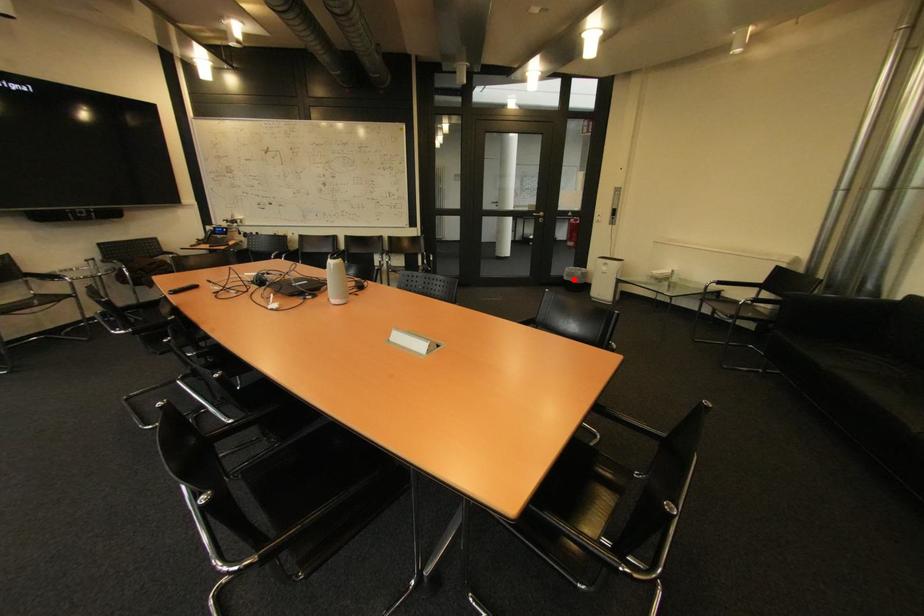
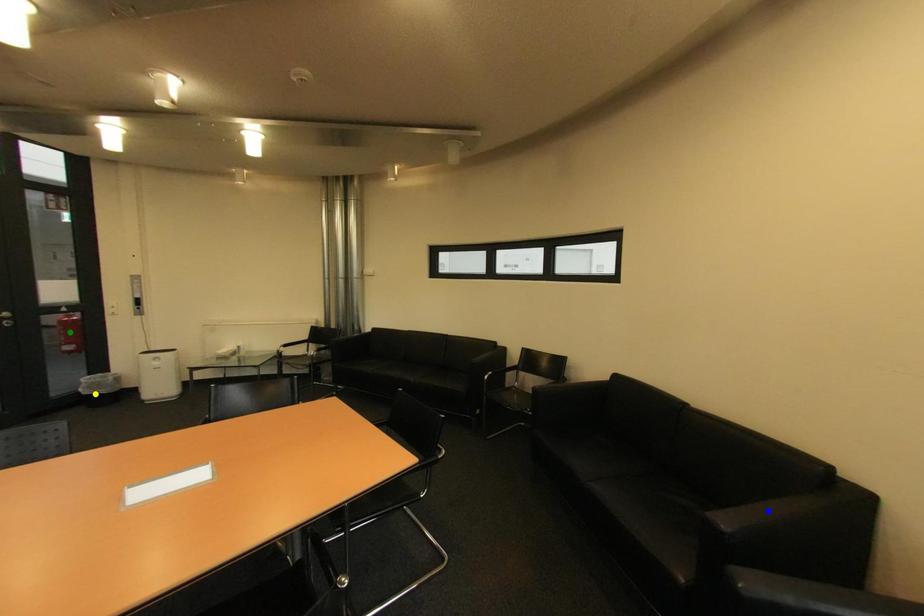
Question: I am providing you with two images of the same scene from different viewpoints. A red point is marked on the first image. You are given multiple points on the second image. In image 2, which mark is for the same physical point as the one in image 1?

Choices:
 (A) green point
 (B) blue point
 (C) yellow point

Answer: (C)